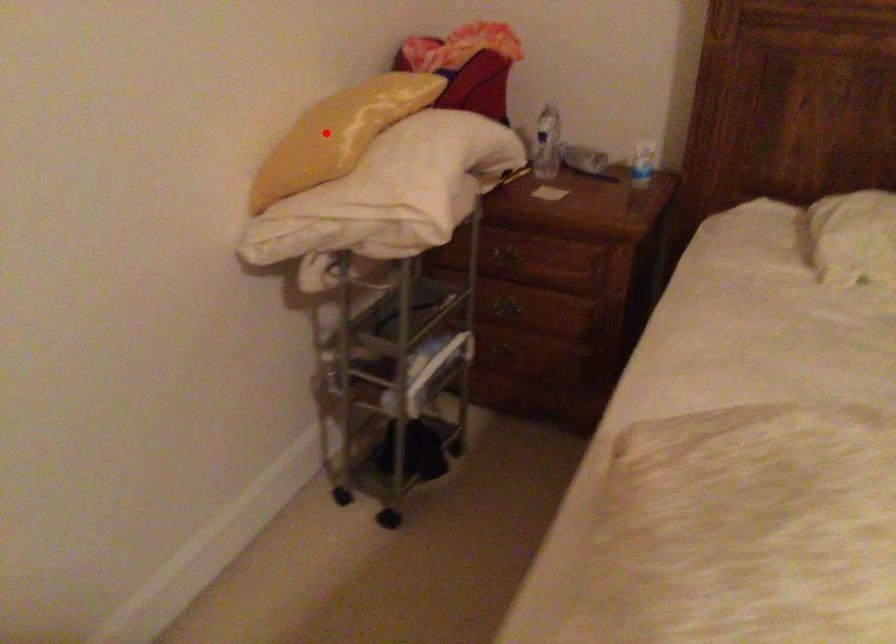
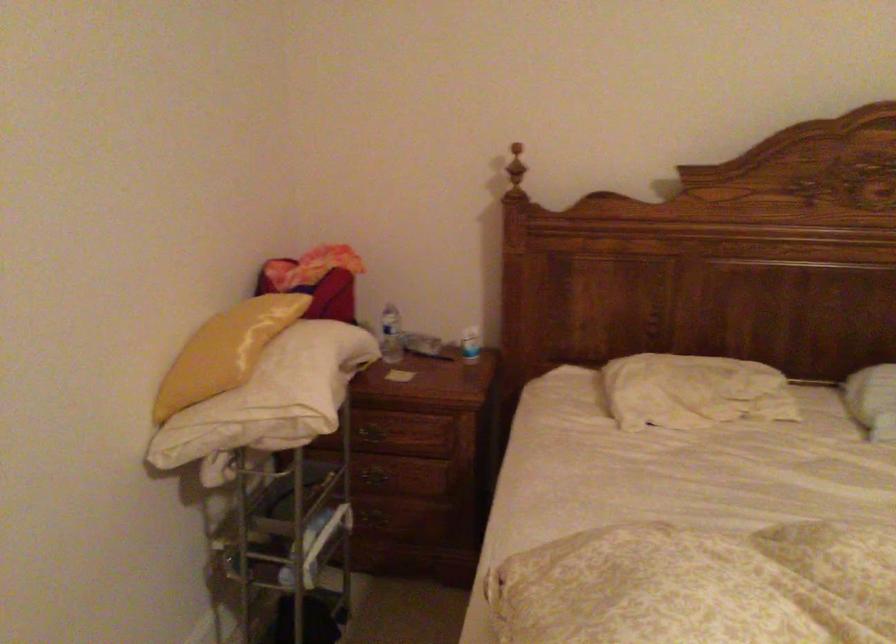
The point at the highlighted location is marked in the first image. Where is the corresponding point in the second image?

(225, 351)